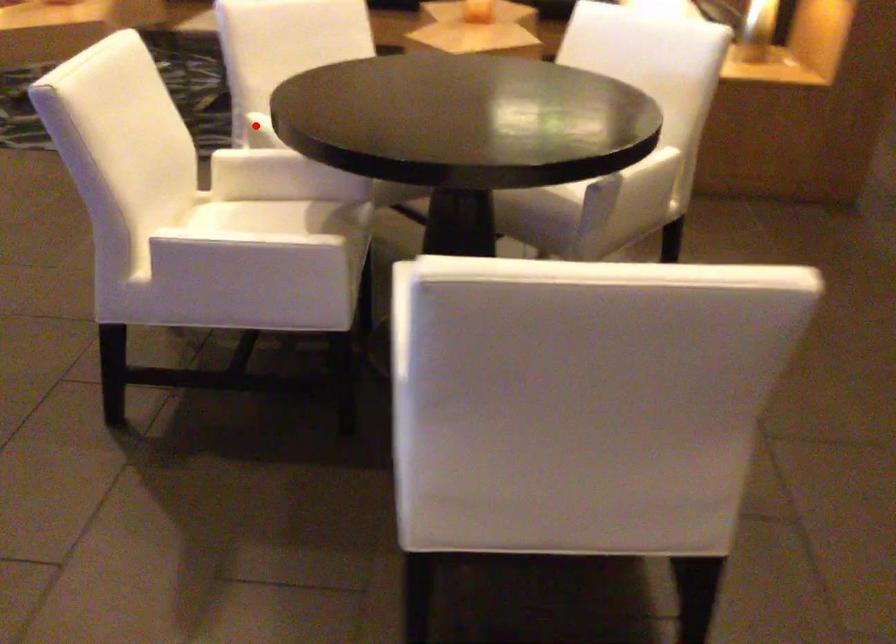
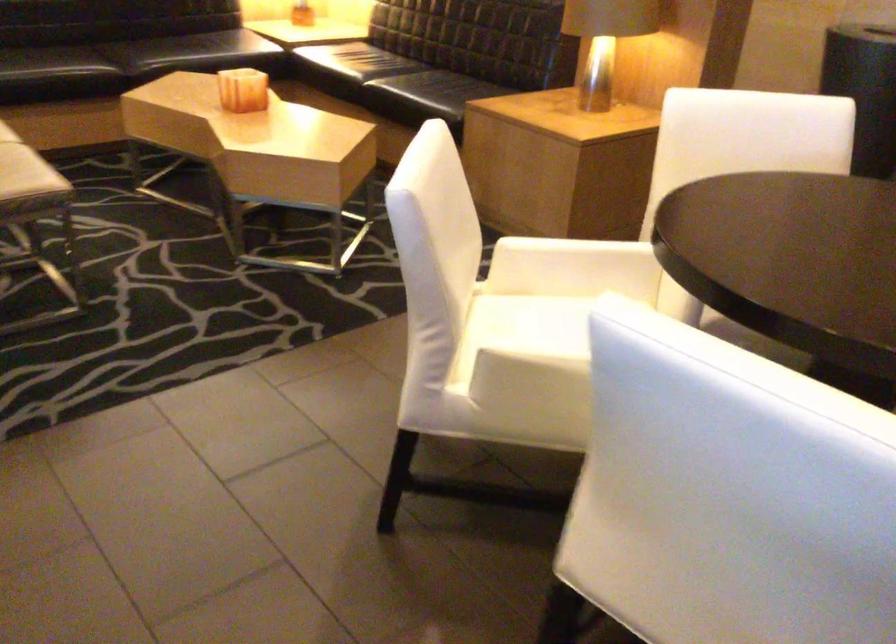
Find the pixel in the second image that matches the highlighted location in the first image.

(526, 366)